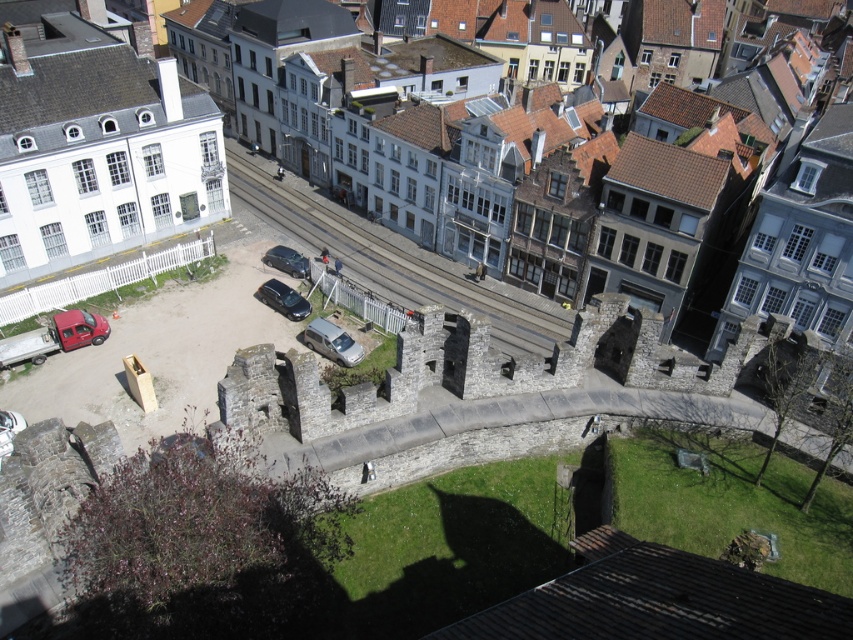
You are a delivery driver who needs to park your 15 feet long truck between the silver metallic van at center and the shiny black car at center. Is there enough space between them to park your truck?

The distance between the silver metallic van at center and the shiny black car at center is 26.26 feet. Since your truck is 15 feet long, there is sufficient space to park between them as 26.26 feet is greater than 15 feet.

You are a delivery driver who needs to park your vehicle in this area. Your vehicle is 1.8 meters tall. The parking spot is between the silver metallic van at center and the shiny black car at center. Can your vehicle fit in this parking spot without hitting the roof?

The silver metallic van at center is much taller than the shiny black car at center. However, the height of the parking spot isn t specified in the scene description. Since the scene doesn t provide information about the parking spot s height, it s impossible to determine if your vehicle will fit without additional details.

You are a photographer standing at the edge of the paved area. You want to take a photo of the smooth asphalt train track at center and the silver metallic van at center. Which object will appear taller in the photo?

The smooth asphalt train track at center will appear taller in the photo because it is taller than the silver metallic van at center according to the description.